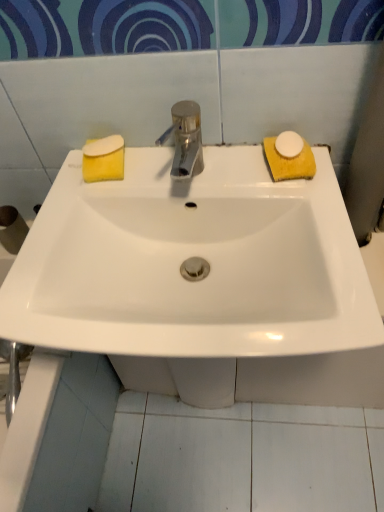
Where is `spots to the right of polished metallic tap at center`? This screenshot has width=384, height=512. spots to the right of polished metallic tap at center is located at coordinates (262, 179).